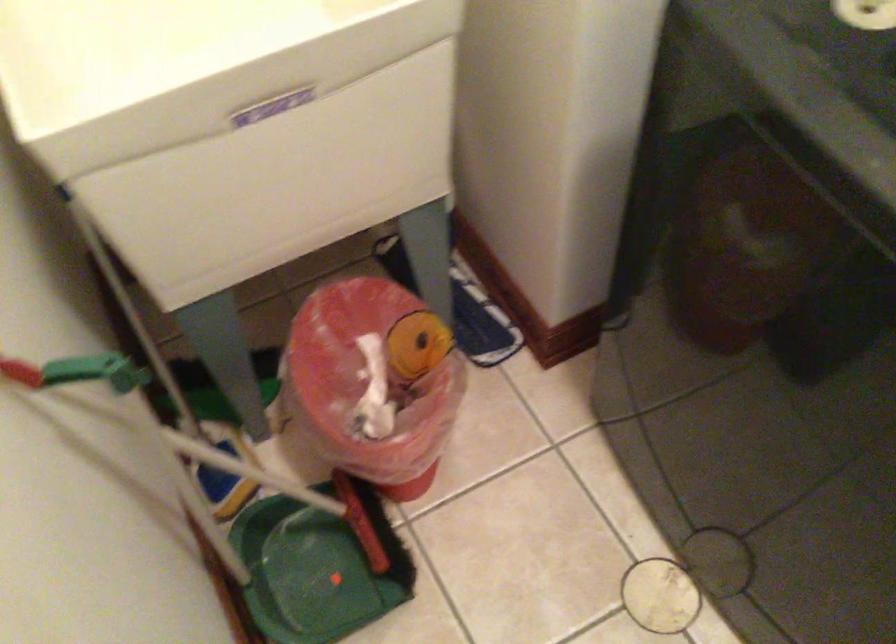
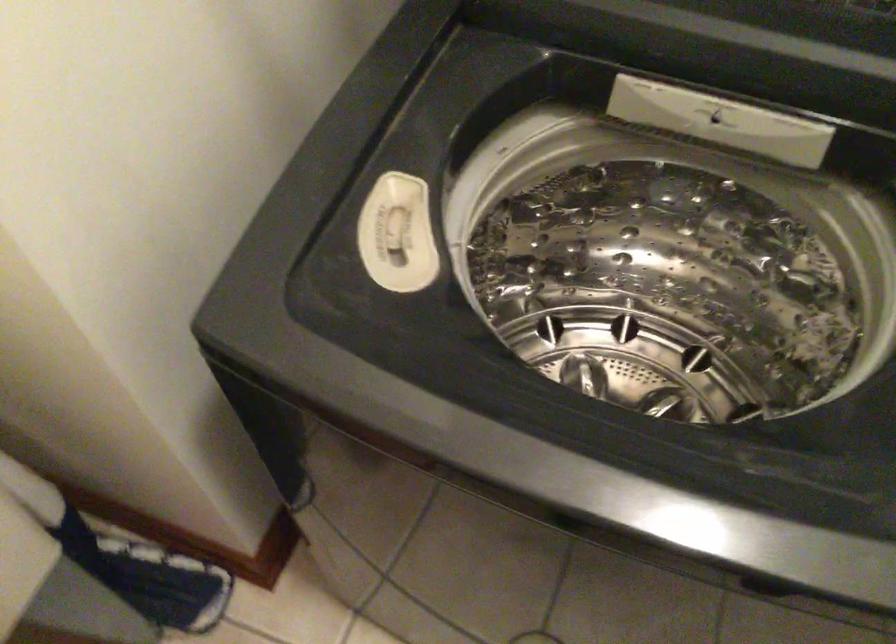
Where in the second image is the point corresponding to point (458, 287) from the first image?

(125, 560)